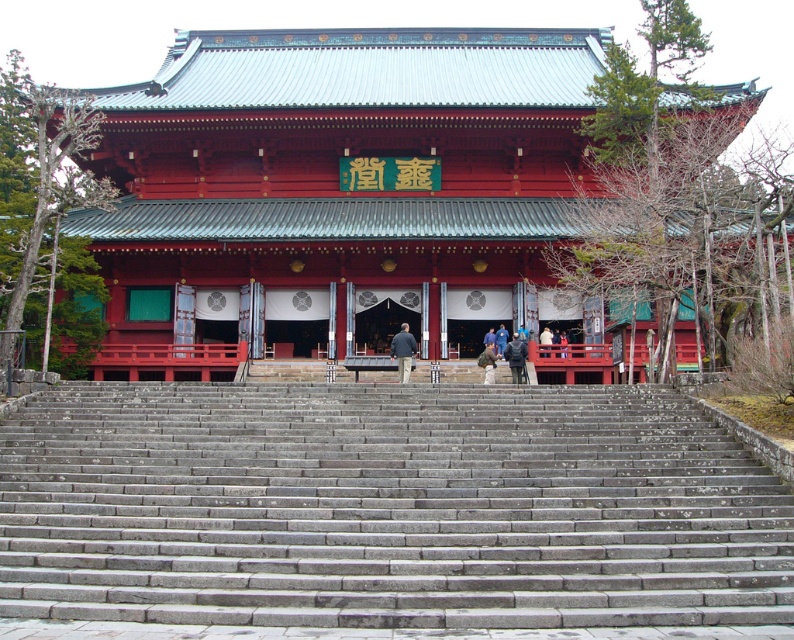
Is gray stone stairs at center to the right of light brown leather jacket at center from the viewer's perspective?

Incorrect, gray stone stairs at center is not on the right side of light brown leather jacket at center.

Which of these two, gray stone stairs at center or light brown leather jacket at center, stands taller?

With more height is gray stone stairs at center.

Is point (719, 524) closer to viewer compared to point (542, 340)?

Yes, point (719, 524) is closer to viewer.

The height and width of the screenshot is (640, 794). What are the coordinates of `gray stone stairs at center` in the screenshot? It's located at click(x=386, y=508).

In the scene shown: Does shiny red wood temple at center appear on the right side of dark gray stone person at center?

No, shiny red wood temple at center is not to the right of dark gray stone person at center.

Between point (363, 134) and point (488, 380), which one is positioned behind?

Point (363, 134)

Where is `shiny red wood temple at center`? The width and height of the screenshot is (794, 640). shiny red wood temple at center is located at coordinates (338, 173).

Is gray stone stairs at center thinner than shiny red wood temple at center?

Yes, gray stone stairs at center is thinner than shiny red wood temple at center.

In the scene shown: Does gray stone stairs at center have a lesser height compared to shiny red wood temple at center?

Yes.

What do you see at coordinates (386, 508) in the screenshot? The width and height of the screenshot is (794, 640). I see `gray stone stairs at center` at bounding box center [386, 508].

Where is `gray stone stairs at center`? The width and height of the screenshot is (794, 640). gray stone stairs at center is located at coordinates (386, 508).